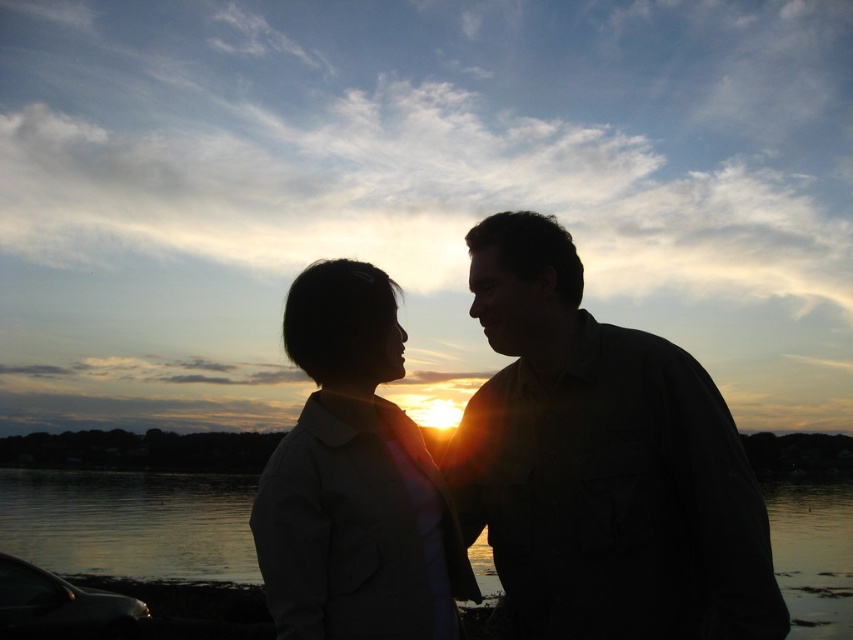
Can you confirm if silhouette couple at center is shorter than glossy water at center?

Indeed, silhouette couple at center has a lesser height compared to glossy water at center.

Between point (477, 518) and point (88, 500), which one is positioned behind?

The point (88, 500) is behind.

Is point (495, 320) behind point (155, 512)?

No.

Locate an element on the screen. This screenshot has width=853, height=640. silhouette couple at center is located at coordinates (601, 465).

From the picture: Can you confirm if silhouette couple at center is positioned to the left of matte beige jacket at center?

No, silhouette couple at center is not to the left of matte beige jacket at center.

Is silhouette couple at center thinner than matte beige jacket at center?

Incorrect, silhouette couple at center's width is not less than matte beige jacket at center's.

Between point (590, 401) and point (376, 467), which one is positioned behind?

Positioned behind is point (590, 401).

You are a GUI agent. You are given a task and a screenshot of the screen. Output one action in this format:
    pyautogui.click(x=<x>, y=<y>)
    Task: Click on the silhouette couple at center
    The height and width of the screenshot is (640, 853).
    Given the screenshot: What is the action you would take?
    pyautogui.click(x=601, y=465)

In the scene shown: Can you confirm if matte beige jacket at center is wider than glossy water at center?

In fact, matte beige jacket at center might be narrower than glossy water at center.

Does point (297, 490) come in front of point (268, 634)?

Yes, it is.

What are the coordinates of `matte beige jacket at center` in the screenshot? It's located at (354, 481).